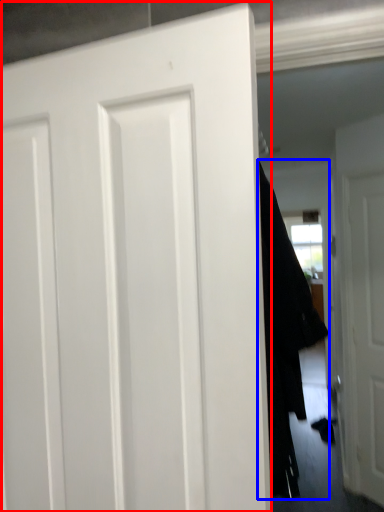
Question: Among these objects, which one is nearest to the camera, door (highlighted by a red box) or garment (highlighted by a blue box)?

Choices:
 (A) door
 (B) garment

Answer: (A)